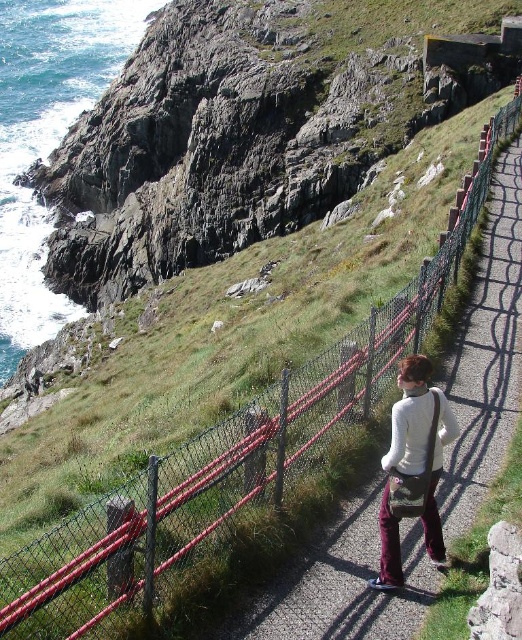
Question: Which point appears closest to the camera in this image?

Choices:
 (A) (318, 19)
 (B) (418, 416)

Answer: (B)

Question: Which point is farther from the camera taking this photo?

Choices:
 (A) (422, 490)
 (B) (86, 275)

Answer: (B)

Question: Can you confirm if green grassy hillside at upper left is positioned to the left of white matte sweater at center?

Choices:
 (A) no
 (B) yes

Answer: (B)

Question: Does green grassy hillside at upper left lie behind white matte sweater at center?

Choices:
 (A) no
 (B) yes

Answer: (B)

Question: Does green grassy hillside at upper left appear on the left side of white matte sweater at center?

Choices:
 (A) yes
 (B) no

Answer: (A)

Question: Which point is farther to the camera?

Choices:
 (A) (381, 563)
 (B) (276, 92)

Answer: (B)